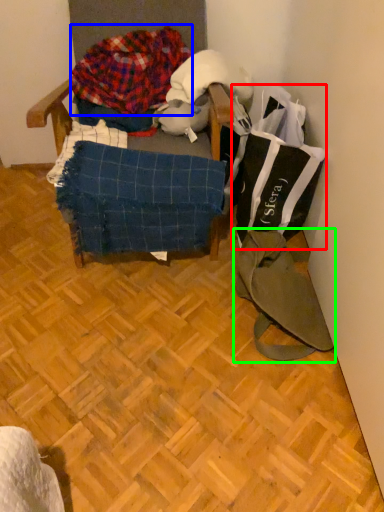
Question: Which object is the farthest from grocery bag (highlighted by a red box)? Choose among these: waste (highlighted by a blue box) or messenger bag (highlighted by a green box).

Choices:
 (A) waste
 (B) messenger bag

Answer: (A)